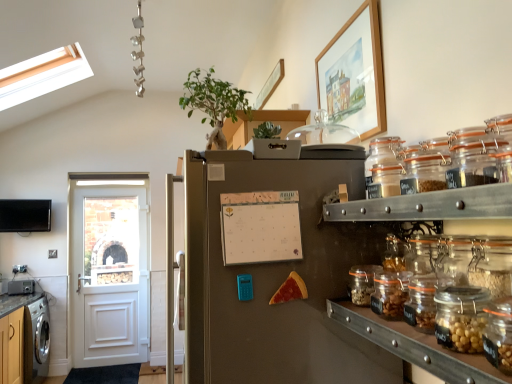
Measure the distance between brushed metal countertop at lower left and camera.

A distance of 3.74 meters exists between brushed metal countertop at lower left and camera.

What is the approximate height of clear glass jar at center-right, the first glass jar from the bottom?

9.67 centimeters.

Find the location of a particular element. This screenshot has width=512, height=384. brushed metal toaster at lower left is located at coordinates (21, 287).

Describe the element at coordinates (21, 287) in the screenshot. The image size is (512, 384). I see `brushed metal toaster at lower left` at that location.

Image resolution: width=512 pixels, height=384 pixels. What do you see at coordinates (108, 268) in the screenshot?
I see `white painted wood door at left` at bounding box center [108, 268].

What do you see at coordinates (389, 294) in the screenshot? The height and width of the screenshot is (384, 512). I see `clear glass jar at right, the 3th glass jar when ordered from top to bottom` at bounding box center [389, 294].

This screenshot has height=384, width=512. What are the coordinates of `brushed metal countertop at lower left` in the screenshot? It's located at (18, 301).

From a real-world perspective, is clear glass jars at right below clear glass jar at center-right, the first glass jar from the bottom?

Indeed, from a real-world perspective, clear glass jars at right is positioned beneath clear glass jar at center-right, the first glass jar from the bottom.

Is clear glass jars at right taller than clear glass jar at center-right, marked as the 4th glass jar in a top-to-bottom arrangement?

Yes.

Which object is positioned more to the right, clear glass jars at right or clear glass jar at center-right, marked as the 4th glass jar in a top-to-bottom arrangement?

clear glass jars at right is more to the right.

Which point is more forward, (6, 298) or (9, 291)?

The point (6, 298) is closer to the camera.

From the image's perspective, which is below, brushed metal countertop at lower left or brushed metal toaster at lower left?

brushed metal countertop at lower left.

Image resolution: width=512 pixels, height=384 pixels. In order to click on counter top to the right of brushed metal toaster at lower left in this screenshot , I will do `click(18, 301)`.

In the scene shown: Is brushed metal countertop at lower left positioned with its back to brushed metal toaster at lower left?

brushed metal countertop at lower left is not turned away from brushed metal toaster at lower left.

Between brushed metal countertop at lower left and clear glass jar at right, which is counted as the second glass jar, starting from the bottom, which one has more height?

brushed metal countertop at lower left is taller.

Is point (35, 298) positioned after point (402, 315)?

That is True.

Which object is wider, brushed metal countertop at lower left or clear glass jar at right, the 3th glass jar when ordered from top to bottom?

With larger width is brushed metal countertop at lower left.

What's the angular difference between brushed metal countertop at lower left and clear glass jar at right, which is counted as the second glass jar, starting from the bottom,'s facing directions?

180 degrees.

Identify the location of food located underneath the green leafy plant at upper center (from a real-world perspective). (290, 290).

Could you tell me if cheesy pizza slice at center is facing green leafy plant at upper center?

No, cheesy pizza slice at center is not oriented towards green leafy plant at upper center.

From a real-world perspective, between cheesy pizza slice at center and green leafy plant at upper center, who is vertically higher?

From a 3D spatial view, green leafy plant at upper center is above.

Based on the photo, which object is positioned more to the right, cheesy pizza slice at center or green leafy plant at upper center?

From the viewer's perspective, cheesy pizza slice at center appears more on the right side.

Considering the relative sizes of clear glass jars at right and cheesy pizza slice at center in the image provided, is clear glass jars at right smaller than cheesy pizza slice at center?

No, clear glass jars at right is not smaller than cheesy pizza slice at center.

Does point (430, 337) lie in front of point (269, 302)?

Yes, point (430, 337) is in front of point (269, 302).

Considering the relative sizes of clear glass jars at right and cheesy pizza slice at center in the image provided, is clear glass jars at right taller than cheesy pizza slice at center?

Yes, clear glass jars at right is taller than cheesy pizza slice at center.

Can you confirm if clear glass jars at right is positioned to the right of cheesy pizza slice at center?

Yes, clear glass jars at right is to the right of cheesy pizza slice at center.

Is brushed metal toaster at lower left inside the boundaries of white painted wood door at left, or outside?

brushed metal toaster at lower left is not inside white painted wood door at left, it's outside.

From the picture: Is brushed metal toaster at lower left shorter than white painted wood door at left?

Indeed, brushed metal toaster at lower left has a lesser height compared to white painted wood door at left.

Where is `appliance on the left of white painted wood door at left`? The height and width of the screenshot is (384, 512). appliance on the left of white painted wood door at left is located at coordinates pyautogui.click(x=21, y=287).

Which point is more forward, (15, 281) or (134, 328)?

The point (15, 281) is closer.

Measure the distance between clear glass jar at right, which is counted as the second glass jar, starting from the bottom, and clear glass jar at center-right, marked as the 4th glass jar in a top-to-bottom arrangement.

clear glass jar at right, which is counted as the second glass jar, starting from the bottom, is 7.38 centimeters from clear glass jar at center-right, marked as the 4th glass jar in a top-to-bottom arrangement.

From the picture: Would you say clear glass jar at right, which is counted as the second glass jar, starting from the bottom, is outside clear glass jar at center-right, the first glass jar from the bottom?

clear glass jar at right, which is counted as the second glass jar, starting from the bottom, is positioned outside clear glass jar at center-right, the first glass jar from the bottom.

Which object is thinner, clear glass jar at right, the 3th glass jar when ordered from top to bottom, or clear glass jar at center-right, marked as the 4th glass jar in a top-to-bottom arrangement?

Thinner between the two is clear glass jar at center-right, marked as the 4th glass jar in a top-to-bottom arrangement.

Is point (386, 302) farther from viewer compared to point (378, 269)?

No, it is not.

There is a clear glass jars at right. Where is `the 2nd glass jar above it (from a real-world perspective)`? This screenshot has height=384, width=512. the 2nd glass jar above it (from a real-world perspective) is located at coordinates point(362,283).

You are a GUI agent. You are given a task and a screenshot of the screen. Output one action in this format:
    pyautogui.click(x=<x>, y=<y>)
    Task: Click on the counter top on the right of brushed metal toaster at lower left
    The image size is (512, 384).
    Given the screenshot: What is the action you would take?
    pyautogui.click(x=18, y=301)

Estimate the real-world distances between objects in this image. Which object is closer to brushed metal toaster at lower left, wooden-framed painting at upper right or green leafy plant at upper center?

green leafy plant at upper center is positioned closer to the anchor brushed metal toaster at lower left.

Based on their spatial positions, is translucent glass jar at upper right, the 2th glass jar positioned from the top, or white painted wood door at left closer to brushed metal countertop at lower left?

Based on the image, white painted wood door at left appears to be nearer to brushed metal countertop at lower left.

Based on their spatial positions, is brushed metal countertop at lower left or cheesy pizza slice at center closer to translucent glass jar at upper right, the 2th glass jar positioned from the top?

cheesy pizza slice at center.

Which object lies nearer to the anchor point clear glass jar at center-right, the first glass jar from the bottom, clear glass jars at right or green leafy plant at upper center?

clear glass jars at right.

Considering their positions, is clear glass jars at right positioned further to translucent glass jar at upper right, the 2th glass jar positioned from the top, than clear glass jar at center-right, marked as the 4th glass jar in a top-to-bottom arrangement?

Based on the image, clear glass jars at right appears to be further to translucent glass jar at upper right, the 2th glass jar positioned from the top.

Considering their positions, is stainless steel refrigerator at center positioned further to clear glass jar at upper right, which is the first glass jar from top to bottom, than clear glass jar at center-right, marked as the 4th glass jar in a top-to-bottom arrangement?

clear glass jar at center-right, marked as the 4th glass jar in a top-to-bottom arrangement, is further to clear glass jar at upper right, which is the first glass jar from top to bottom.

Estimate the real-world distances between objects in this image. Which object is further from green leafy plant at upper center, brushed metal toaster at lower left or clear glass jar at right, which is counted as the second glass jar, starting from the bottom?

The object further to green leafy plant at upper center is brushed metal toaster at lower left.

When comparing their distances from translucent glass jar at upper right, which is the third glass jar from bottom to top, does clear glass jar at upper right, the 4th glass jar ordered from the bottom, or green leafy plant at upper center seem closer?

Based on the image, clear glass jar at upper right, the 4th glass jar ordered from the bottom, appears to be nearer to translucent glass jar at upper right, which is the third glass jar from bottom to top.

Find the location of a particular element. houseplant located between clear glass jar at right, which is counted as the second glass jar, starting from the bottom, and brushed metal toaster at lower left in the depth direction is located at coordinates pyautogui.click(x=213, y=103).

The image size is (512, 384). I want to click on houseplant positioned between clear glass jars at right and white painted wood door at left from near to far, so click(213, 103).

Locate an element on the screen. food located between clear glass jar at upper right, which is the first glass jar from top to bottom, and brushed metal countertop at lower left in the depth direction is located at coordinates (290, 290).

The width and height of the screenshot is (512, 384). I want to click on food between clear glass jar at center-right, the first glass jar from the bottom, and brushed metal countertop at lower left from front to back, so click(x=290, y=290).